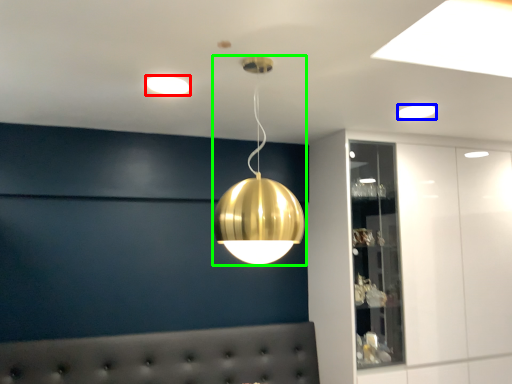
Question: Which is nearer to the lamp (highlighted by a red box)? lamp (highlighted by a blue box) or lamp (highlighted by a green box).

Choices:
 (A) lamp
 (B) lamp

Answer: (B)